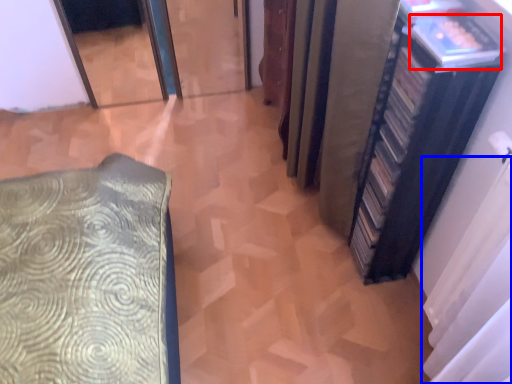
Question: Which of the following is the closest to the observer, book (highlighted by a red box) or curtain (highlighted by a blue box)?

Choices:
 (A) book
 (B) curtain

Answer: (B)